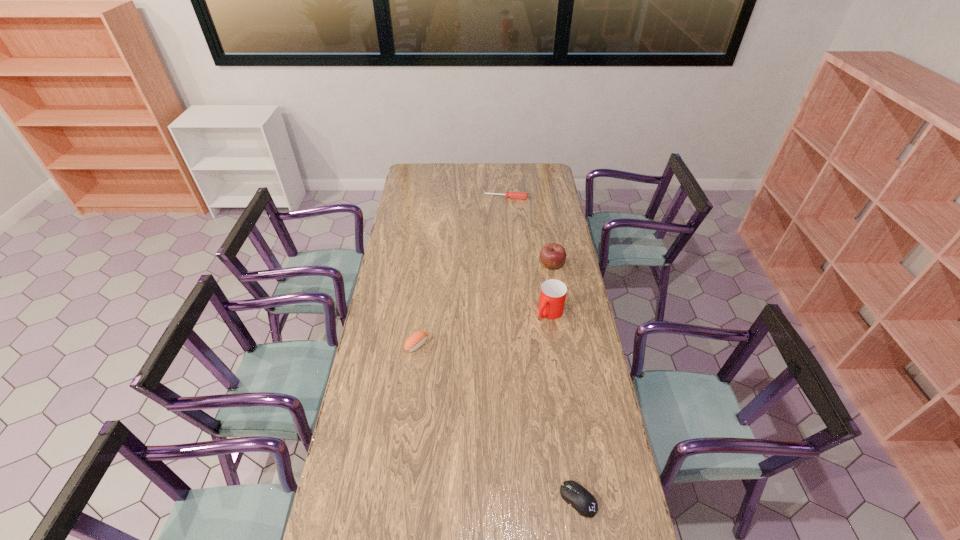
Locate an element on the screen. The height and width of the screenshot is (540, 960). object that is the fourth nearest to the nearest object is located at coordinates (515, 195).

This screenshot has height=540, width=960. Find the location of `vacant point that satisfies the following two spatial constraints: 1. on the front side of the third nearest object; 2. on the right side of the screwdriver`. vacant point that satisfies the following two spatial constraints: 1. on the front side of the third nearest object; 2. on the right side of the screwdriver is located at coordinates (515, 313).

This screenshot has height=540, width=960. Find the location of `vacant space that satisfies the following two spatial constraints: 1. on the back side of the apple; 2. on the right side of the third tallest object`. vacant space that satisfies the following two spatial constraints: 1. on the back side of the apple; 2. on the right side of the third tallest object is located at coordinates (427, 265).

Locate an element on the screen. This screenshot has width=960, height=540. vacant space that satisfies the following two spatial constraints: 1. on the back side of the farthest object; 2. on the right side of the second nearest object is located at coordinates (436, 198).